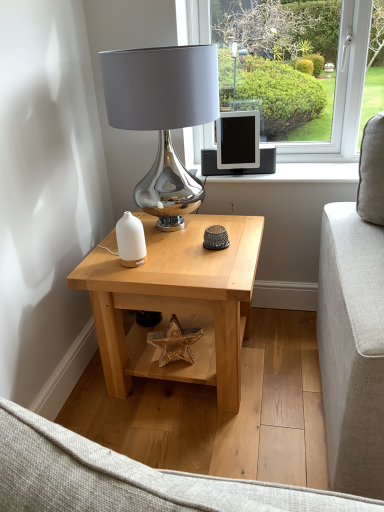
I want to click on free space in front of white glossy candle holder at center, so click(134, 276).